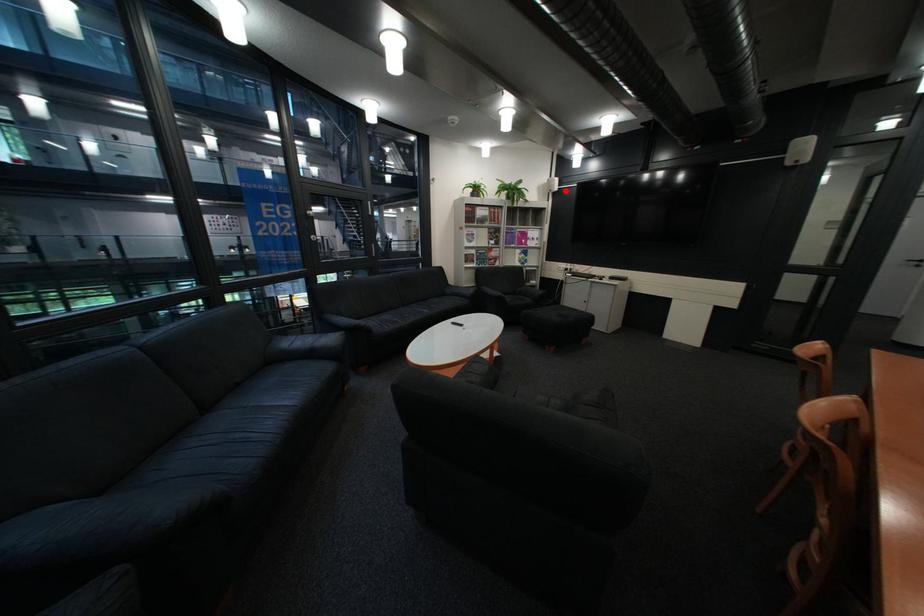
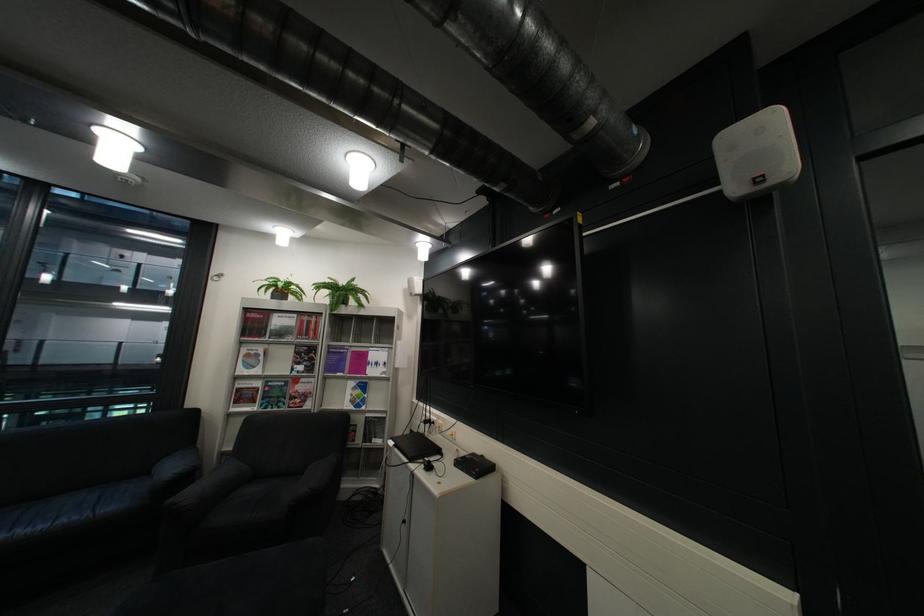
The point at the highlighted location is marked in the first image. Where is the corresponding point in the second image?

(427, 294)